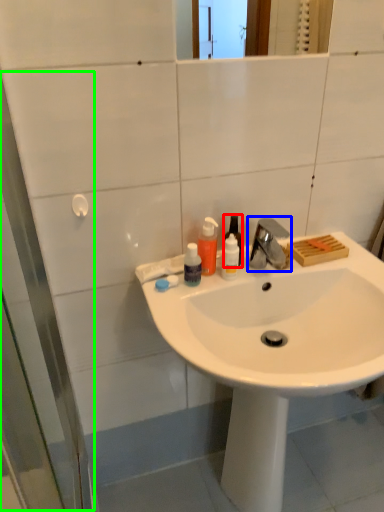
Question: Which object is the farthest from bottle (highlighted by a red box)? Choose among these: tap (highlighted by a blue box) or screen door (highlighted by a green box).

Choices:
 (A) tap
 (B) screen door

Answer: (B)